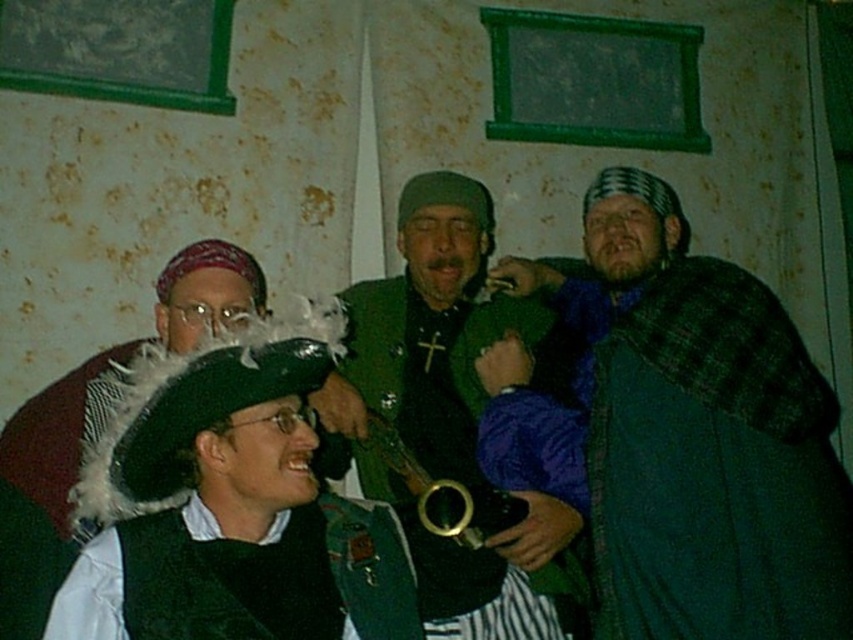
Who is lower down, velvet green vest at lower left or velvet black hat at center?

velvet green vest at lower left is below.

Is velvet green vest at lower left wider than velvet black hat at center?

No.

Is point (192, 516) farther from camera compared to point (125, 346)?

That is False.

Locate an element on the screen. Image resolution: width=853 pixels, height=640 pixels. velvet green vest at lower left is located at coordinates 241,577.

Can you confirm if velvet green vest at center is taller than velvet green vest at lower left?

Yes.

Does velvet green vest at center have a lesser width compared to velvet green vest at lower left?

Yes.

Describe the element at coordinates (709, 451) in the screenshot. I see `velvet green vest at center` at that location.

Identify the location of velvet green vest at center. (709, 451).

Between velvet green vest at center and green woolen cloak at right, which one has less height?

Standing shorter between the two is velvet green vest at center.

Between point (633, 513) and point (770, 632), which one is positioned behind?

Point (633, 513)

You are a GUI agent. You are given a task and a screenshot of the screen. Output one action in this format:
    pyautogui.click(x=<x>, y=<y>)
    Task: Click on the velvet green vest at center
    The height and width of the screenshot is (640, 853).
    Given the screenshot: What is the action you would take?
    pyautogui.click(x=709, y=451)